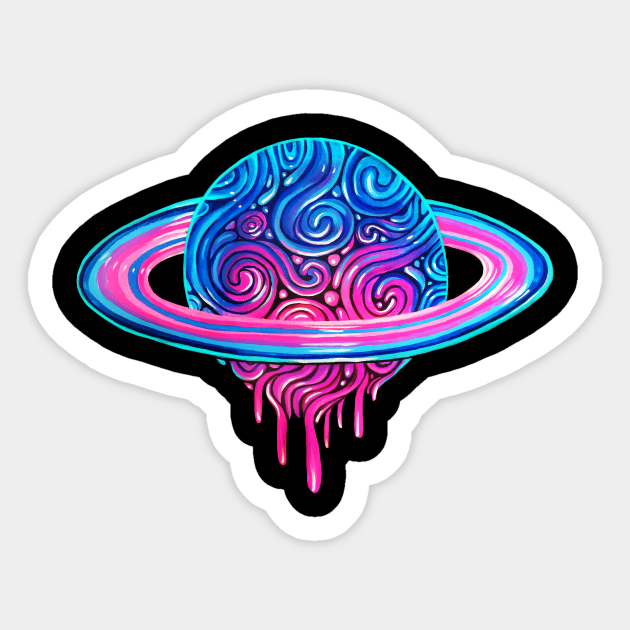
Find the location of a particular element. table is located at coordinates (569, 450).